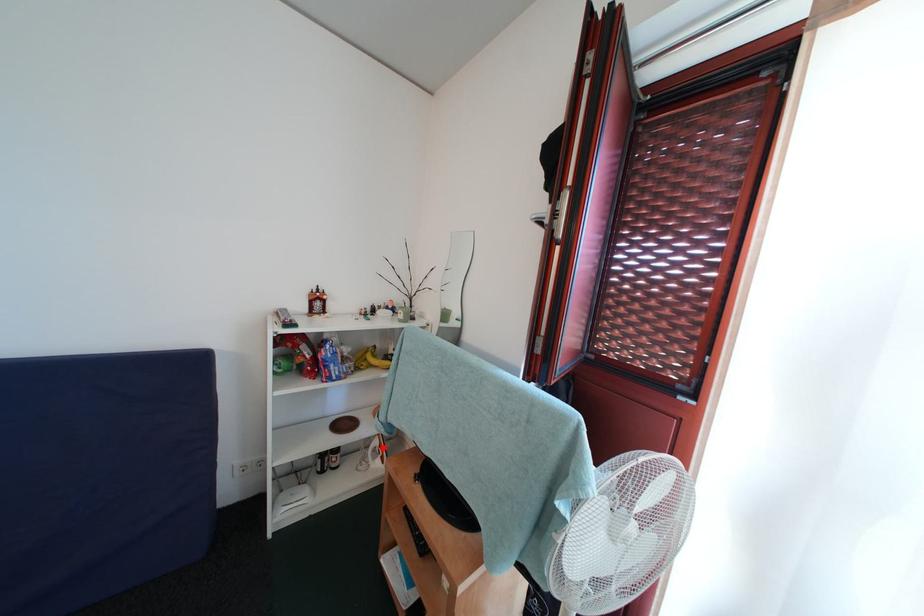
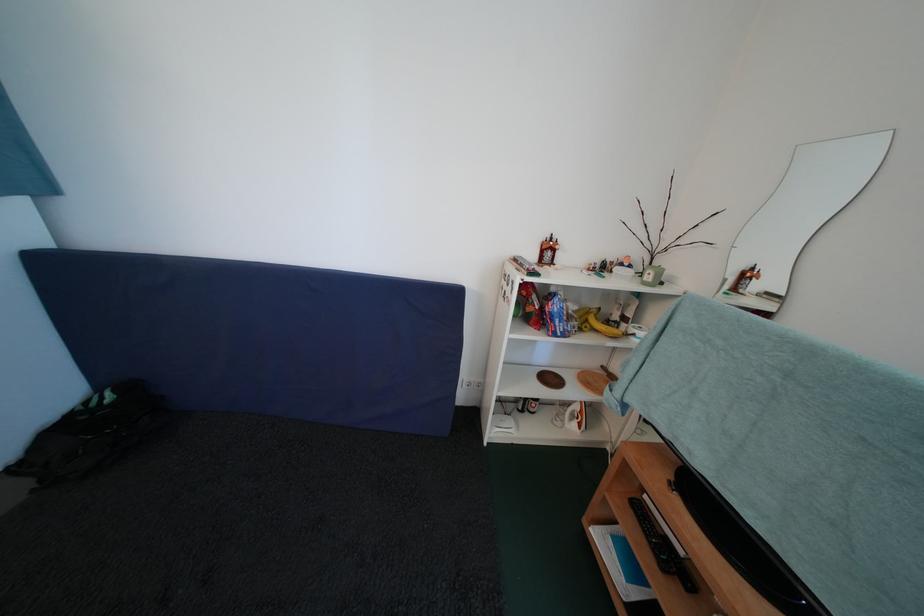
Question: I am providing you with two images of the same scene from different viewpoints. A red point is shown in image1. For the corresponding object point in image2, is it positioned nearer or farther from the camera?

Choices:
 (A) Nearer
 (B) Farther

Answer: (A)